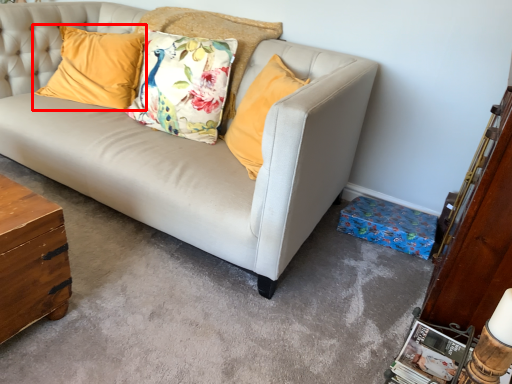
Question: Where is pillow (annotated by the red box) located in relation to pillow in the image?

Choices:
 (A) left
 (B) right

Answer: (A)